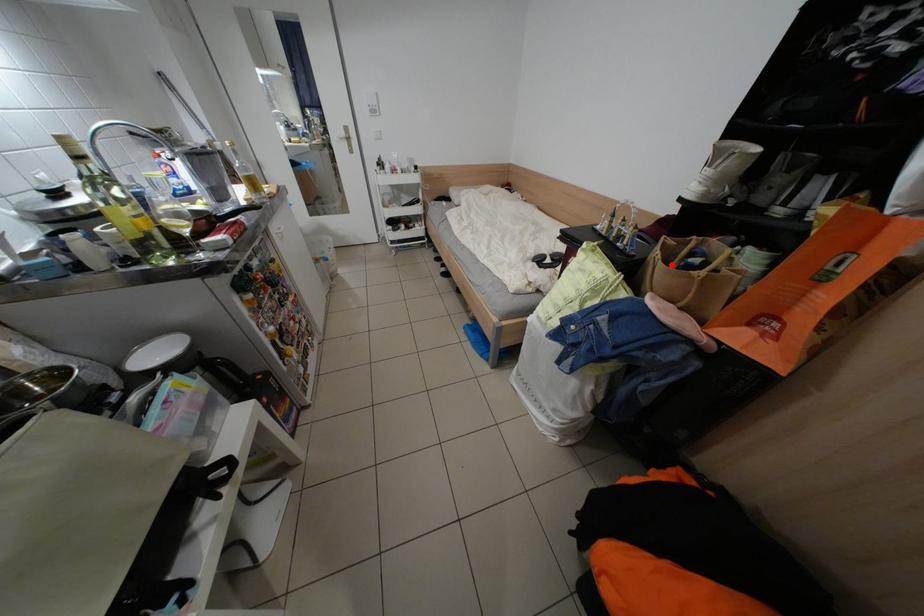
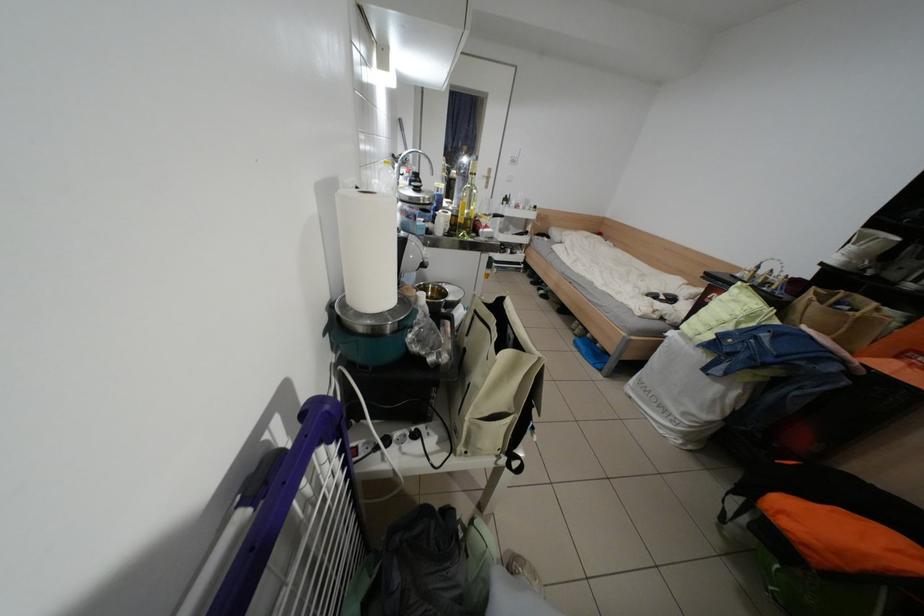
Question: I am providing you with two images of the same scene from different viewpoints. A red point is shown in image1. For the corresponding object point in image2, is it positioned nearer or farther from the camera?

Choices:
 (A) Nearer
 (B) Farther

Answer: (B)